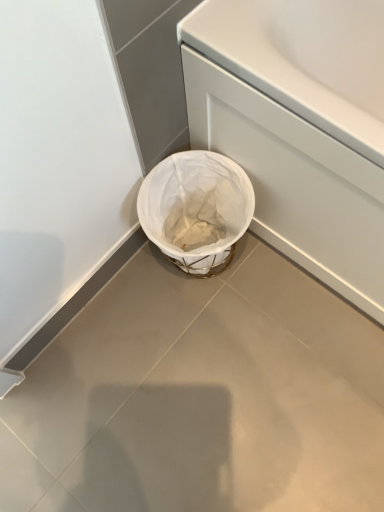
Locate an element on the screen. The image size is (384, 512). vacant space in white fabric basket at lower center (from a real-world perspective) is located at coordinates (187, 248).